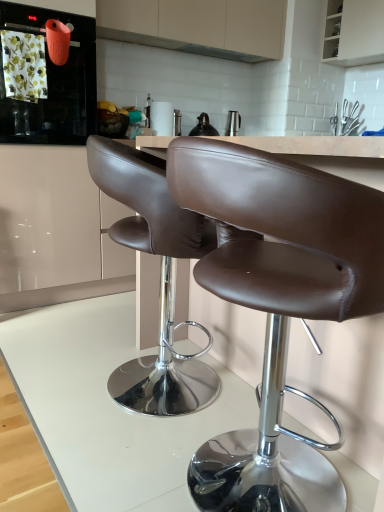
The width and height of the screenshot is (384, 512). In order to click on free region on the left part of brown leather chair at center, the 1th chair positioned from the back in this screenshot , I will do `click(56, 382)`.